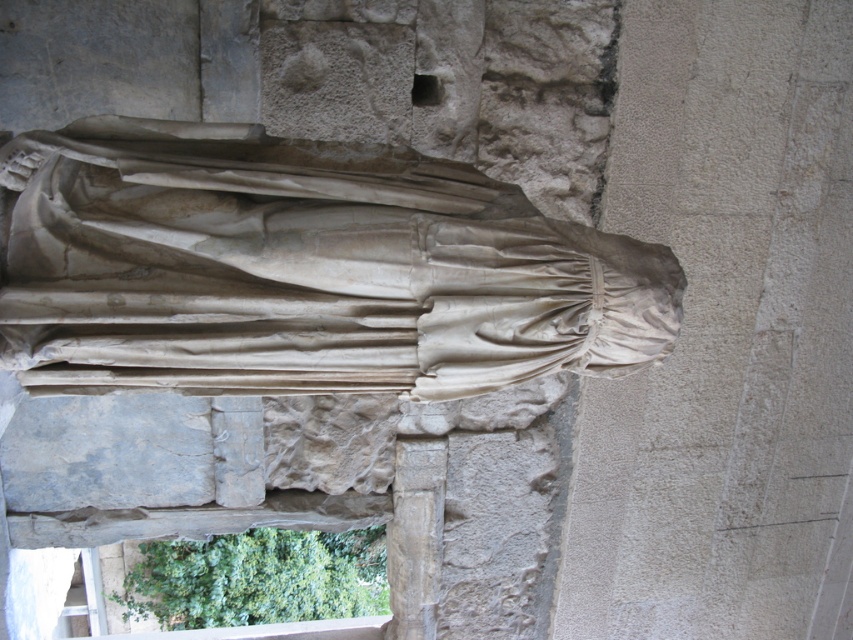
Based on the photo, does white marble statue at center have a smaller size compared to smooth stone column at center?

Actually, white marble statue at center might be larger than smooth stone column at center.

Between point (451, 220) and point (437, 458), which one is positioned behind?

Positioned behind is point (437, 458).

You are a GUI agent. You are given a task and a screenshot of the screen. Output one action in this format:
    pyautogui.click(x=<x>, y=<y>)
    Task: Click on the white marble statue at center
    The height and width of the screenshot is (640, 853).
    Given the screenshot: What is the action you would take?
    pyautogui.click(x=300, y=268)

Locate an element on the screen. This screenshot has width=853, height=640. white marble statue at center is located at coordinates (300, 268).